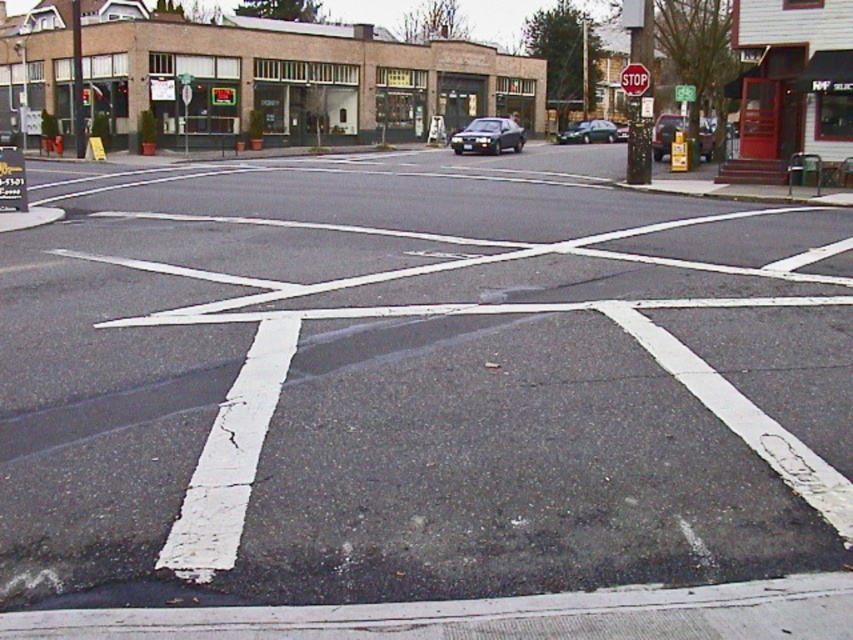
You are a pedestrian waiting at the crosswalk. You see the shiny dark green sedan at center and the red metallic stop sign at upper center. Which object is closer to the crosswalk?

The shiny dark green sedan at center is closer to the crosswalk than the red metallic stop sign at upper center because it is positioned below it.

You are a pedestrian standing at the edge of the crosswalk. You see the black asphalt at center and the green plastic sign at upper center. Which object is positioned to the left of the other?

The black asphalt at center is to the left of the green plastic sign at upper center.

In the scene shown: You are a delivery driver who needs to park your shiny dark green sedan at center in a space that requires vehicles to be no wider than the red metallic stop sign at upper center. Can your vehicle fit within the width requirement?

The shiny dark green sedan at center has a width less than the red metallic stop sign at upper center, so it can fit within the width requirement.